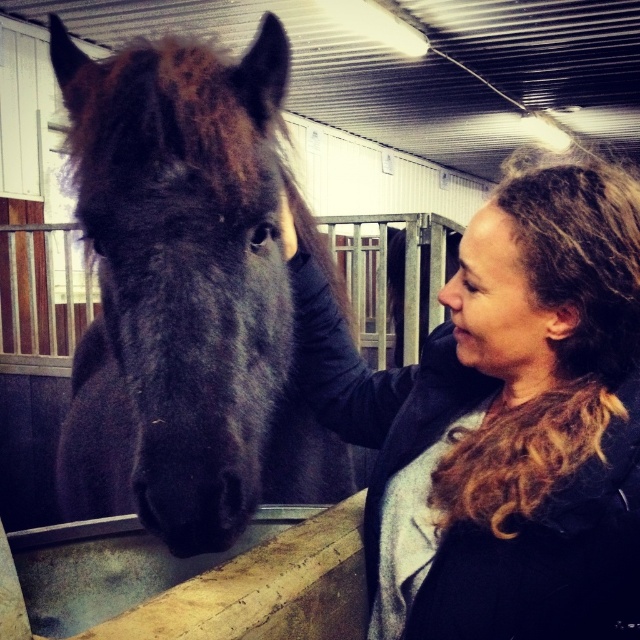
You are a photographer trying to capture a closeup of the dark brown fuzzy horse at center and the curly hair at upper right. Which object is wider so that you can adjust your camera focus accordingly?

The dark brown fuzzy horse at center is wider than the curly hair at upper right, so you should focus on the dark brown fuzzy horse at center for better framing.

You are standing in a stable and want to reach a specific point marked at coordinates point (502, 490). You have a tool that can extend up to 36 inches. Will your tool be long enough to reach that point?

The distance of point (502, 490) from viewer is 37.97 inches, so the tool can not reach it as it requires 37.97 inches and the tool can only extend 36 inches.

You are standing in the stable and want to see the person clearly. Which object, the curly hair at upper right or the matte black nose at center, is closer to you?

The curly hair at upper right is closer to you because it is in front of the matte black nose at center.